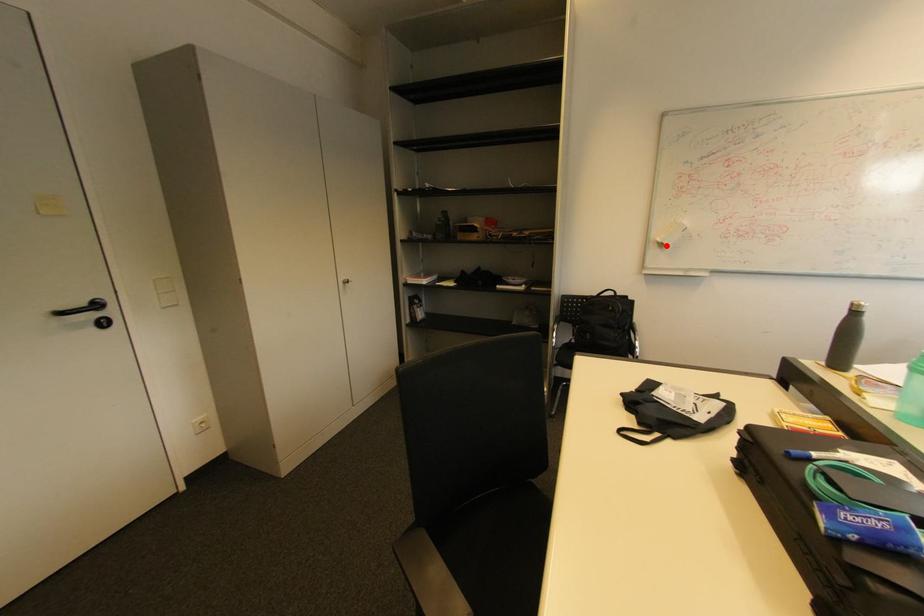
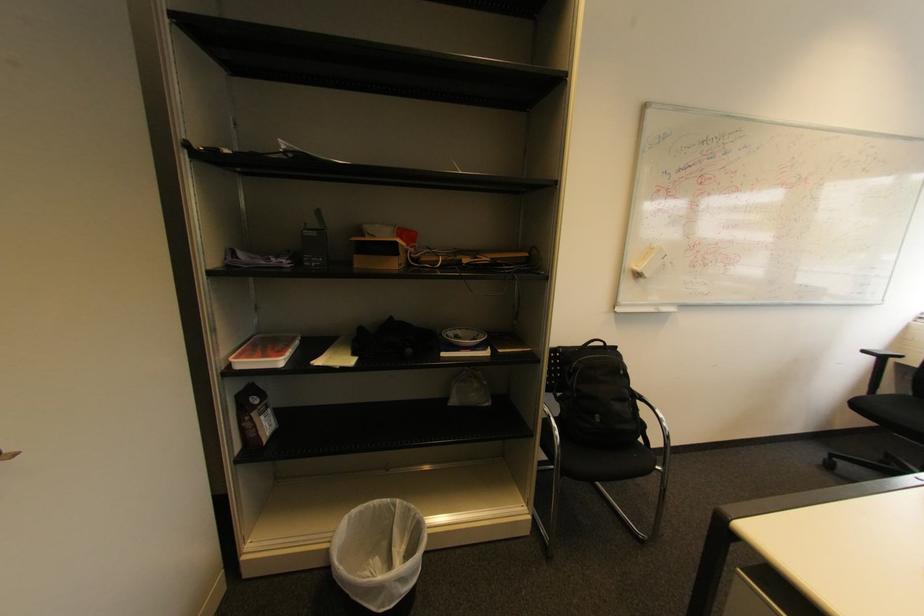
Find the pixel in the second image that matches the highlighted location in the first image.

(643, 276)